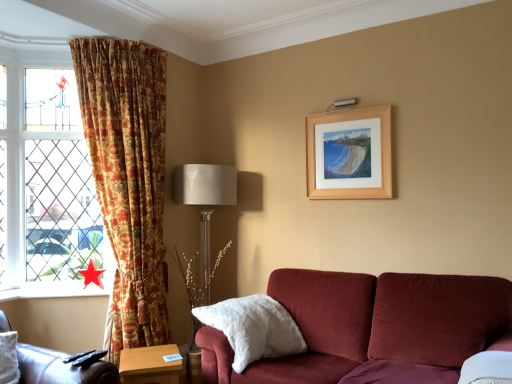
Find the location of a particular element. red paper star at lower left is located at coordinates (92, 275).

This screenshot has height=384, width=512. Describe the element at coordinates (253, 328) in the screenshot. I see `white fluffy pillow at lower center` at that location.

Describe the element at coordinates (60, 368) in the screenshot. I see `leather at left` at that location.

Based on the photo, measure the distance between wooden table at lower center and camera.

wooden table at lower center is 2.49 meters away from camera.

The width and height of the screenshot is (512, 384). In order to click on stained glass window at left in this screenshot , I will do `click(46, 184)`.

What do you see at coordinates (368, 158) in the screenshot?
I see `wooden picture frame at upper right` at bounding box center [368, 158].

Find the location of a particular element. Image resolution: width=512 pixels, height=384 pixels. red paper star at lower left is located at coordinates (92, 275).

Is red paper star at lower left located outside stained glass window at left?

red paper star at lower left lies outside stained glass window at left's area.

Considering the relative positions of red paper star at lower left and stained glass window at left in the image provided, is red paper star at lower left to the right of stained glass window at left from the viewer's perspective?

Yes.

Would you say red paper star at lower left is a long distance from stained glass window at left?

No, red paper star at lower left is not far away from stained glass window at left.

From the image's perspective, is red paper star at lower left positioned above or below stained glass window at left?

Based on their image positions, red paper star at lower left is located beneath stained glass window at left.

There is a stained glass window at left. Identify the location of picture frame above it (from a real-world perspective). (368, 158).

Is stained glass window at left located within wooden picture frame at upper right?

That's incorrect, stained glass window at left is not inside wooden picture frame at upper right.

From the image's perspective, is wooden picture frame at upper right located above or below stained glass window at left?

wooden picture frame at upper right is situated higher than stained glass window at left in the image.

Is wooden picture frame at upper right taller than stained glass window at left?

Incorrect, the height of wooden picture frame at upper right is not larger of that of stained glass window at left.

Locate an element on the screen. The height and width of the screenshot is (384, 512). table that is under the floral fabric curtain at left (from a real-world perspective) is located at coordinates (149, 365).

Based on the photo, looking at the image, does floral fabric curtain at left seem bigger or smaller compared to wooden table at lower center?

Considering their sizes, floral fabric curtain at left takes up more space than wooden table at lower center.

From a real-world perspective, which object rests below the other?

wooden table at lower center is physically lower.

Could you tell me if floral fabric curtain at left is facing wooden table at lower center?

No, floral fabric curtain at left is not facing towards wooden table at lower center.

Considering the positions of points (81, 373) and (253, 314), is point (81, 373) closer to camera compared to point (253, 314)?

Yes, point (81, 373) is closer to viewer.

Which object is positioned more to the left, leather at left or white fluffy pillow at lower center?

Positioned to the left is leather at left.

Between leather at left and white fluffy pillow at lower center, which one has smaller width?

With smaller width is white fluffy pillow at lower center.

From a real-world perspective, which is physically above, leather at left or white fluffy pillow at lower center?

leather at left is physically above.

From a real-world perspective, is red paper star at lower left physically located above or below satin beige lampshade at center?

In terms of real-world spatial position, red paper star at lower left is above satin beige lampshade at center.

Based on the photo, between red paper star at lower left and satin beige lampshade at center, which one has less height?

red paper star at lower left.

How much distance is there between red paper star at lower left and satin beige lampshade at center?

They are 37.03 inches apart.

How many degrees apart are the facing directions of red paper star at lower left and satin beige lampshade at center?

red paper star at lower left and satin beige lampshade at center are facing 22.9 degrees away from each other.

From the image's perspective, relative to stained glass window at left, is leather at left above or below?

Based on their image positions, leather at left is located beneath stained glass window at left.

Who is smaller, leather at left or stained glass window at left?

stained glass window at left is smaller.

Looking at this image, from a real-world perspective, which is physically below, leather at left or stained glass window at left?

leather at left.

I want to click on star above the leather at left (from the image's perspective), so click(92, 275).

Which is nearer, (93,381) or (90,272)?

The point (93,381) is closer.

Are leather at left and red paper star at lower left beside each other?

No, leather at left is not touching red paper star at lower left.

From the picture: From a real-world perspective, is leather at left positioned under red paper star at lower left based on gravity?

Correct, in the physical world, leather at left is lower than red paper star at lower left.

Identify the location of window located above the red paper star at lower left (from the image's perspective). (46, 184).

This screenshot has height=384, width=512. What are the coordinates of `window below the wooden picture frame at upper right (from a real-world perspective)` in the screenshot? It's located at (46, 184).

When comparing their distances from wooden picture frame at upper right, does white fluffy pillow at lower center or leather at left seem closer?

white fluffy pillow at lower center.

Looking at the image, which one is located further to white fluffy pillow at lower center, red paper star at lower left or stained glass window at left?

stained glass window at left is further to white fluffy pillow at lower center.

Looking at the image, which one is located closer to wooden table at lower center, white fluffy pillow at lower center or red paper star at lower left?

white fluffy pillow at lower center lies closer to wooden table at lower center than the other object.

Based on the photo, estimate the real-world distances between objects in this image. Which object is closer to floral fabric curtain at left, satin beige lampshade at center or stained glass window at left?

stained glass window at left.

Looking at the image, which one is located closer to red paper star at lower left, satin beige lampshade at center or wooden picture frame at upper right?

satin beige lampshade at center is positioned closer to the anchor red paper star at lower left.

Based on their spatial positions, is red paper star at lower left or leather at left closer to floral fabric curtain at left?

red paper star at lower left.

Looking at the image, which one is located closer to white fluffy pillow at lower center, floral fabric curtain at left or red paper star at lower left?

Among the two, floral fabric curtain at left is located nearer to white fluffy pillow at lower center.

Estimate the real-world distances between objects in this image. Which object is further from wooden table at lower center, white fluffy pillow at lower center or wooden picture frame at upper right?

wooden picture frame at upper right lies further to wooden table at lower center than the other object.

The image size is (512, 384). Find the location of `curtain between stained glass window at left and white fluffy pillow at lower center from left to right`. curtain between stained glass window at left and white fluffy pillow at lower center from left to right is located at coordinates point(128,177).

At what (x,y) coordinates should I click in order to perform the action: click on star between leather at left and stained glass window at left from front to back. Please return your answer as a coordinate pair (x, y). The height and width of the screenshot is (384, 512). Looking at the image, I should click on (92, 275).

Identify the location of pillow between leather at left and satin beige lampshade at center along the z-axis. This screenshot has width=512, height=384. (253, 328).

Where is `table lamp between wooden picture frame at upper right and white fluffy pillow at lower center in the vertical direction`? This screenshot has height=384, width=512. table lamp between wooden picture frame at upper right and white fluffy pillow at lower center in the vertical direction is located at coordinates (205, 203).